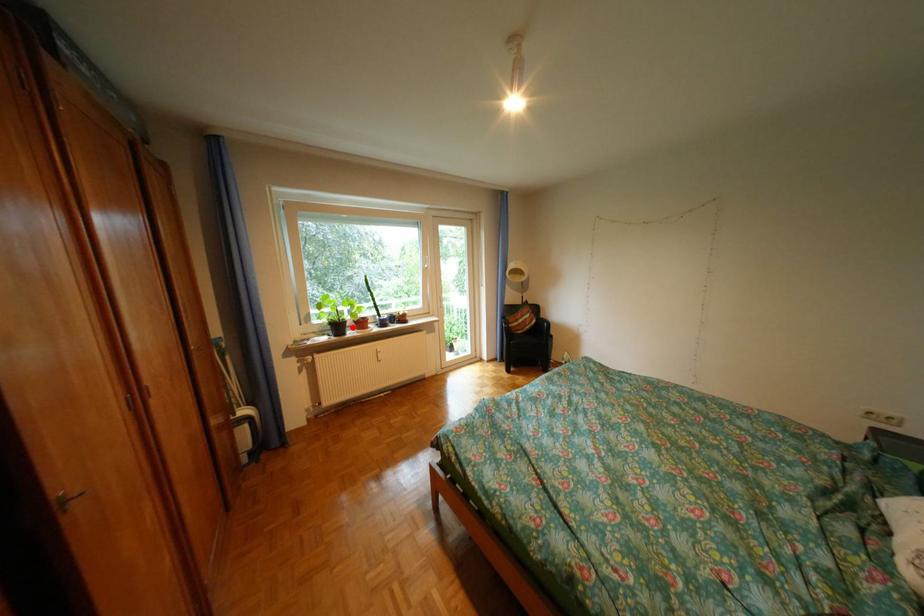
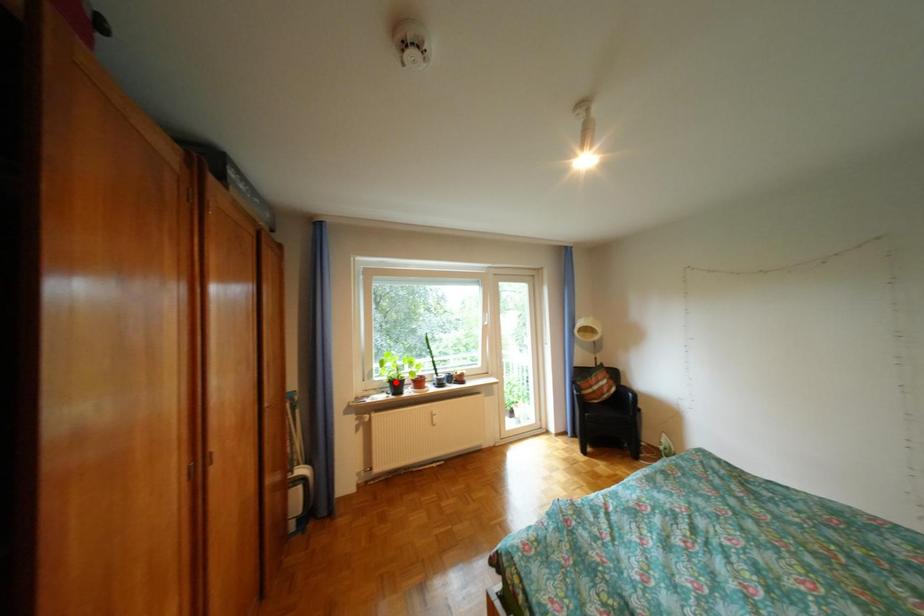
From the picture: I am providing you with two images of the same scene from different viewpoints. A red point is marked on the first image and another point is marked on the second image. Are the points marked in image1 and image2 representing the same 3D position?

No